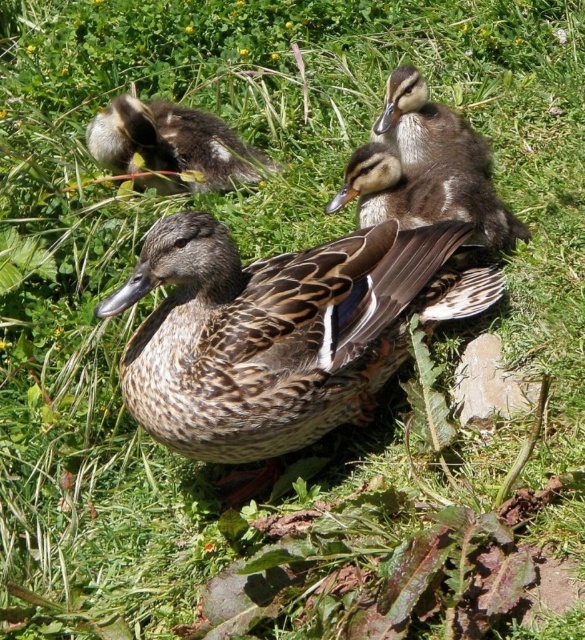
Question: Does brown fuzzy duckling at upper left appear on the right side of brown speckled duckling at center?

Choices:
 (A) no
 (B) yes

Answer: (A)

Question: Where is brown fuzzy duckling at upper left located in relation to brown speckled duckling at center in the image?

Choices:
 (A) above
 (B) below

Answer: (A)

Question: In this image, where is brown speckled duck at center located relative to brown speckled duckling at center?

Choices:
 (A) right
 (B) left

Answer: (B)

Question: Which point is farther to the camera?

Choices:
 (A) brown fuzzy duckling at upper left
 (B) brown speckled duckling at center

Answer: (A)

Question: Estimate the real-world distances between objects in this image. Which object is farther from the brown speckled duck at center?

Choices:
 (A) brown fuzzy duckling at upper left
 (B) brown speckled duckling at upper center
 (C) brown speckled duckling at center

Answer: (A)

Question: Considering the real-world distances, which object is farthest from the brown speckled duckling at upper center?

Choices:
 (A) brown speckled duck at center
 (B) brown speckled duckling at center

Answer: (A)